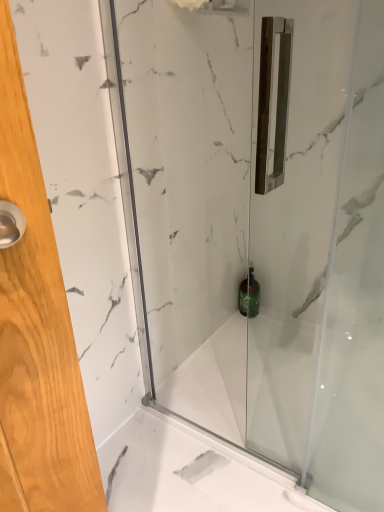
Question: Considering the relative sizes of transparent glass shower door at center and green glass bottle at center in the image provided, is transparent glass shower door at center shorter than green glass bottle at center?

Choices:
 (A) no
 (B) yes

Answer: (A)

Question: Is the depth of transparent glass shower door at center greater than that of green glass bottle at center?

Choices:
 (A) no
 (B) yes

Answer: (A)

Question: From the image's perspective, is transparent glass shower door at center below green glass bottle at center?

Choices:
 (A) yes
 (B) no

Answer: (B)

Question: From the image's perspective, is transparent glass shower door at center located above green glass bottle at center?

Choices:
 (A) no
 (B) yes

Answer: (B)

Question: Does transparent glass shower door at center have a greater width compared to green glass bottle at center?

Choices:
 (A) no
 (B) yes

Answer: (A)

Question: Can you confirm if transparent glass shower door at center is positioned to the right of green glass bottle at center?

Choices:
 (A) yes
 (B) no

Answer: (B)

Question: From the image's perspective, would you say green glass bottle at center is shown under transparent glass shower door at center?

Choices:
 (A) yes
 (B) no

Answer: (A)

Question: Is green glass bottle at center surrounding transparent glass shower door at center?

Choices:
 (A) no
 (B) yes

Answer: (A)

Question: Is green glass bottle at center shorter than transparent glass shower door at center?

Choices:
 (A) yes
 (B) no

Answer: (A)

Question: Considering the relative sizes of green glass bottle at center and transparent glass shower door at center in the image provided, is green glass bottle at center wider than transparent glass shower door at center?

Choices:
 (A) no
 (B) yes

Answer: (B)

Question: Is green glass bottle at center directly adjacent to transparent glass shower door at center?

Choices:
 (A) no
 (B) yes

Answer: (A)

Question: Are green glass bottle at center and transparent glass shower door at center far apart?

Choices:
 (A) yes
 (B) no

Answer: (B)

Question: Considering the positions of green glass bottle at center and transparent glass shower door at center in the image, is green glass bottle at center wider or thinner than transparent glass shower door at center?

Choices:
 (A) wide
 (B) thin

Answer: (A)